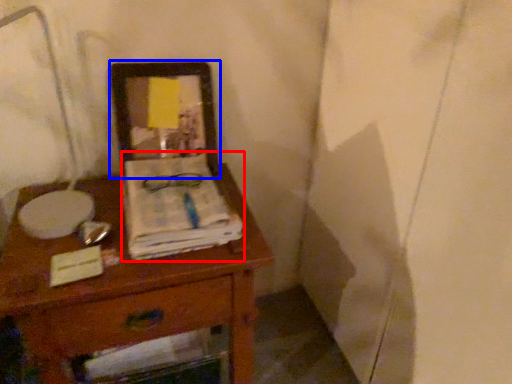
Question: Among these objects, which one is farthest to the camera, magazine (highlighted by a red box) or picture frame (highlighted by a blue box)?

Choices:
 (A) magazine
 (B) picture frame

Answer: (B)